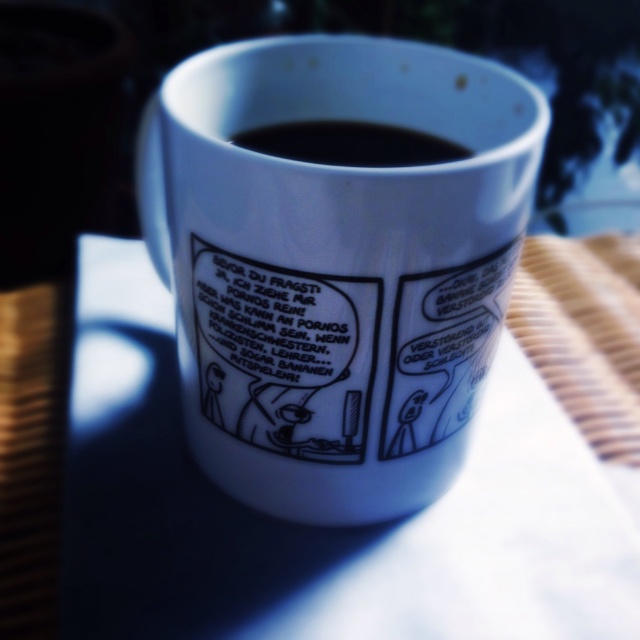
From the picture: You are a person sitting at a desk. You want to reach for the white glossy mug at center to take a sip. Is the white fabric at upper center in the way of your hand when you reach for the mug?

The white glossy mug at center is closer to the viewer than the white fabric at upper center, so the white fabric at upper center is behind the mug and not in the way of your hand when reaching for it.

What is the relationship between the height of the white fabric at upper center and the black glossy coffee at upper center in the image?

The white fabric at upper center is much taller than the black glossy coffee at upper center.